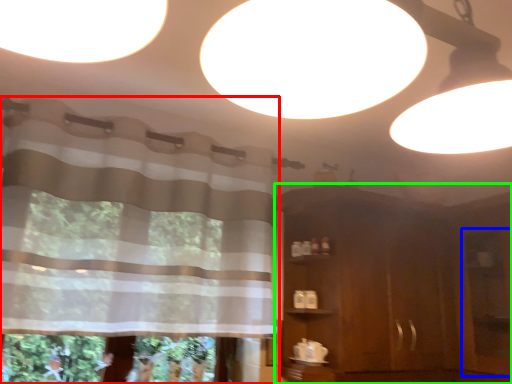
Question: Based on their relative distances, which object is farther from curtain (highlighted by a red box)? Choose from screen door (highlighted by a blue box) and dresser (highlighted by a green box).

Choices:
 (A) screen door
 (B) dresser

Answer: (A)